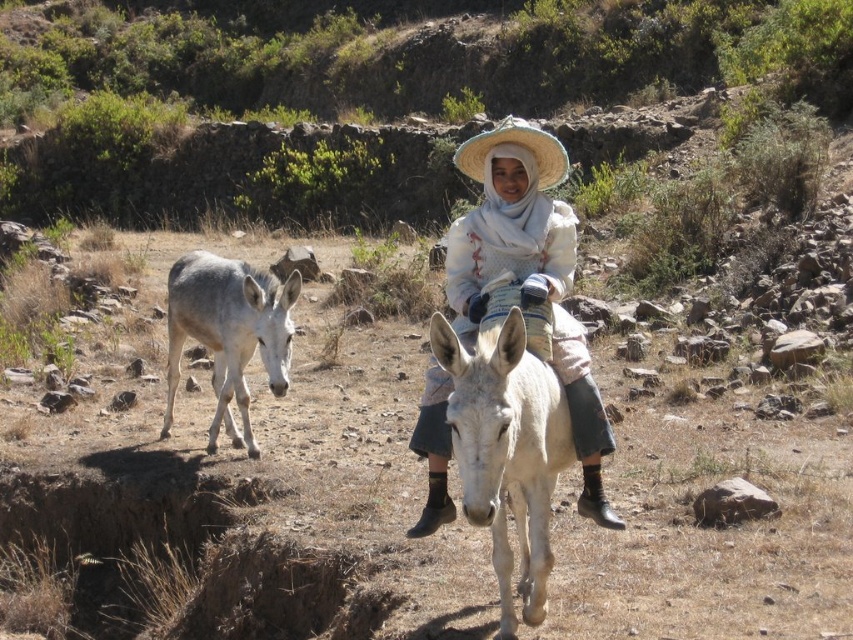
Which is below, white cotton dress at center or white matte donkey at left?

white matte donkey at left

Between point (450, 248) and point (206, 307), which one is positioned behind?

Positioned behind is point (206, 307).

The height and width of the screenshot is (640, 853). What are the coordinates of `white cotton dress at center` in the screenshot? It's located at (509, 221).

Based on the photo, is white matte donkey at center wider than white matte donkey at left?

No.

Who is lower down, white matte donkey at center or white matte donkey at left?

white matte donkey at center is lower down.

Who is more forward, (540, 490) or (213, 268)?

Point (540, 490) is in front.

At what (x,y) coordinates should I click in order to perform the action: click on white matte donkey at center. Please return your answer as a coordinate pair (x, y). Looking at the image, I should click on (506, 451).

Does white matte donkey at left have a smaller size compared to natural straw hat at center?

Yes, white matte donkey at left is smaller than natural straw hat at center.

Is point (283, 285) farther from camera compared to point (497, 132)?

Yes, point (283, 285) is farther from viewer.

Find the location of a particular element. The image size is (853, 640). white matte donkey at left is located at coordinates (228, 332).